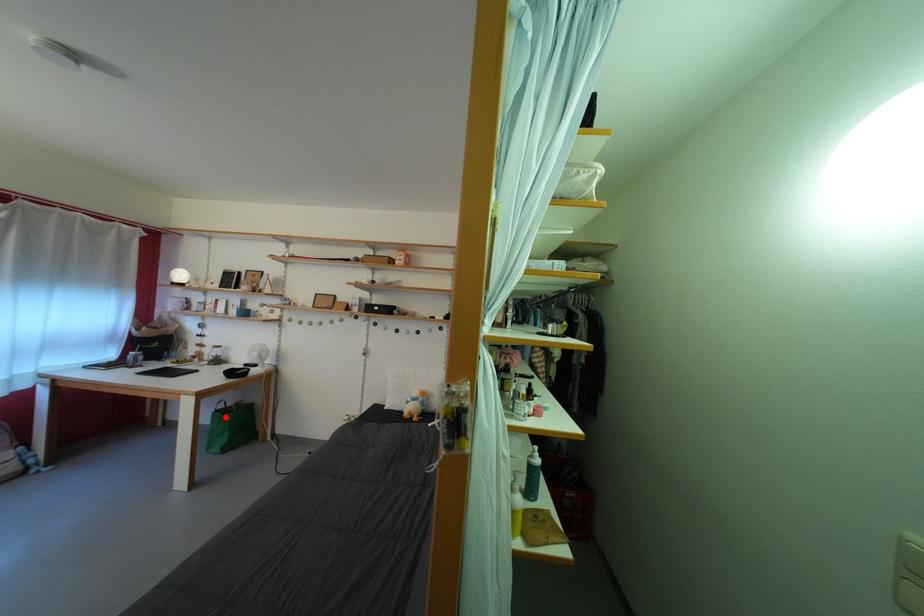
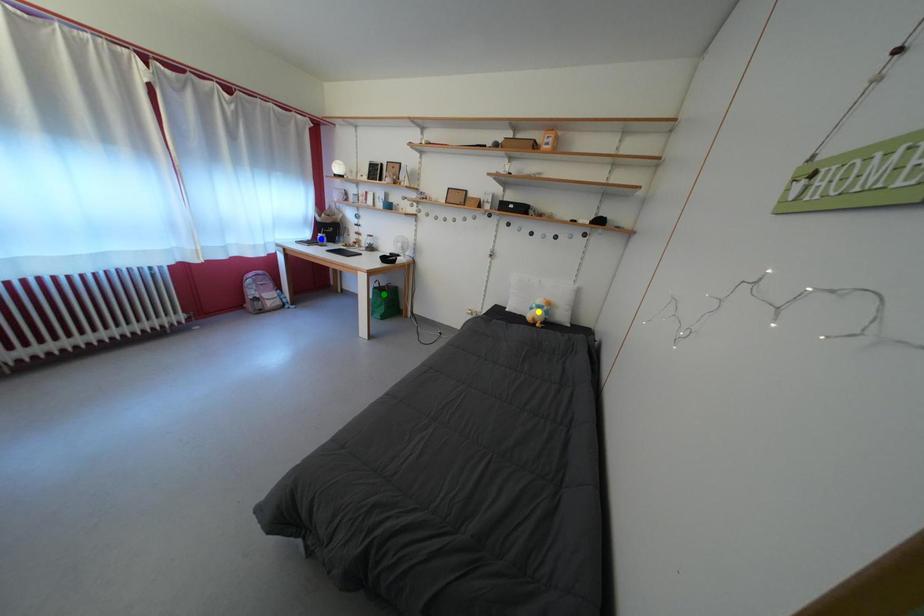
Question: I am providing you with two images of the same scene from different viewpoints. A red point is marked on the first image. You are given multiple points on the second image. Which point in image 2 represents the same 3d spot as the red point in image 1?

Choices:
 (A) blue point
 (B) green point
 (C) yellow point

Answer: (B)